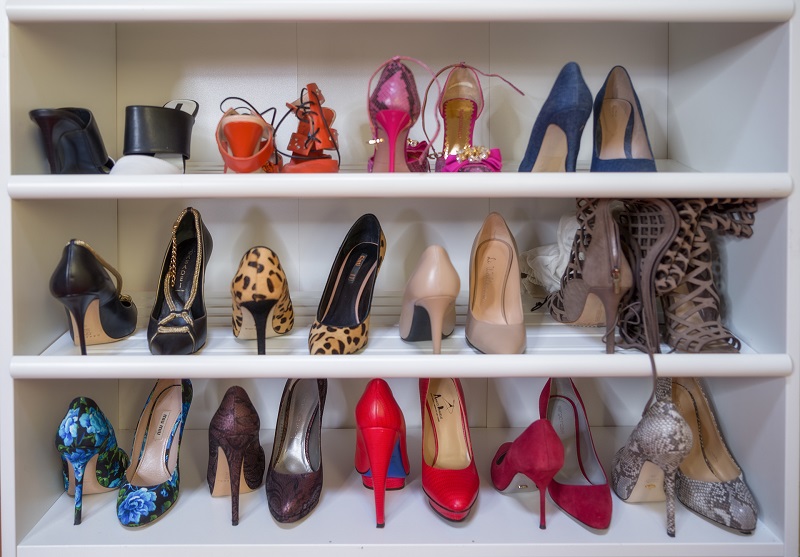
Identify the location of heels on top shelf. Image resolution: width=800 pixels, height=557 pixels. click(629, 117), click(574, 113), click(456, 101), click(390, 117), click(302, 133), click(234, 145), click(157, 133), click(62, 136).